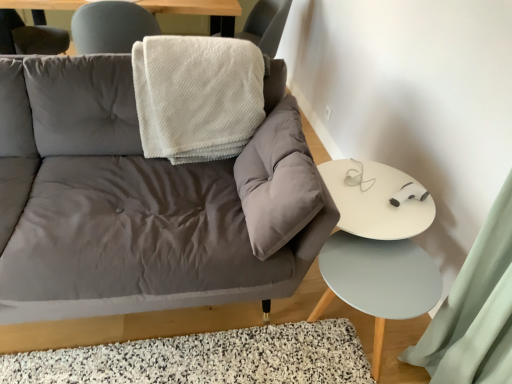
Locate an element on the screen. Image resolution: width=512 pixels, height=384 pixels. white fluffy blanket at upper center is located at coordinates (197, 96).

Measure the distance between point (200, 150) and camera.

Point (200, 150) is 5.63 feet away from camera.

The width and height of the screenshot is (512, 384). I want to click on light blue matte side table at lower right, so click(378, 281).

Measure the distance between point (42, 336) and camera.

Point (42, 336) is 5.10 feet away from camera.

Locate an element on the screen. This screenshot has height=384, width=512. white glossy table at right is located at coordinates (380, 243).

What do you see at coordinates (206, 358) in the screenshot? I see `white shaggy rug at lower center` at bounding box center [206, 358].

Where is `white fluffy blanket at upper center`? white fluffy blanket at upper center is located at coordinates (197, 96).

Which is closer to the camera, [378,265] or [384,312]?

Point [378,265].

Based on their positions, is light blue matte side table at lower right located to the left or right of white glossy table at right?

In the image, light blue matte side table at lower right appears on the left side of white glossy table at right.

From a real-world perspective, who is located lower, light blue matte side table at lower right or white shaggy rug at lower center?

white shaggy rug at lower center, from a real-world perspective.

Are light blue matte side table at lower right and white shaggy rug at lower center located far from each other?

light blue matte side table at lower right is actually quite close to white shaggy rug at lower center.

From the image's perspective, is light blue matte side table at lower right over white shaggy rug at lower center?

Yes, from the image's perspective, light blue matte side table at lower right is on top of white shaggy rug at lower center.

Considering the relative sizes of matte gray couch at center and white shaggy rug at lower center in the image provided, is matte gray couch at center taller than white shaggy rug at lower center?

Yes, matte gray couch at center is taller than white shaggy rug at lower center.

Is matte gray couch at center wider than white shaggy rug at lower center?

Yes, matte gray couch at center is wider than white shaggy rug at lower center.

Consider the image. Which is more to the right, matte gray couch at center or white shaggy rug at lower center?

From the viewer's perspective, white shaggy rug at lower center appears more on the right side.

Considering their positions, is matte gray couch at center located in front of or behind white shaggy rug at lower center?

matte gray couch at center is positioned closer to the viewer than white shaggy rug at lower center.

Where is `chair lying behind the white shaggy rug at lower center`? chair lying behind the white shaggy rug at lower center is located at coordinates (266, 25).

From a real-world perspective, is white shaggy rug at lower center beneath white textured blanket at upper center?

Yes, from a real-world perspective, white shaggy rug at lower center is under white textured blanket at upper center.

Considering their positions, is white shaggy rug at lower center located in front of or behind white textured blanket at upper center?

Answer: Clearly, white shaggy rug at lower center is in front of white textured blanket at upper center.

Based on their positions, is white shaggy rug at lower center located to the left or right of white textured blanket at upper center?

In the image, white shaggy rug at lower center appears on the left side of white textured blanket at upper center.

Are white glossy table at right and matte gray couch at center beside each other?

No, white glossy table at right is not beside matte gray couch at center.

Looking at this image, can you confirm if white glossy table at right is positioned to the right of matte gray couch at center?

Indeed, white glossy table at right is positioned on the right side of matte gray couch at center.

Based on their sizes in the image, would you say white glossy table at right is bigger or smaller than matte gray couch at center?

Clearly, white glossy table at right is smaller in size than matte gray couch at center.

Choose the correct answer: Is white glossy table at right inside matte gray couch at center or outside it?

The correct answer is: outside.

Is white fluffy blanket at upper center at the back of white textured blanket at upper center?

No.

Between white textured blanket at upper center and white fluffy blanket at upper center, which one has less height?

With less height is white fluffy blanket at upper center.

Would you say white textured blanket at upper center contains white fluffy blanket at upper center?

No, white fluffy blanket at upper center is not inside white textured blanket at upper center.

Does white textured blanket at upper center have a lesser width compared to white fluffy blanket at upper center?

Yes, white textured blanket at upper center is thinner than white fluffy blanket at upper center.

From the picture: Is matte gray couch at center positioned far away from white fluffy blanket at upper center?

No, there isn't a large distance between matte gray couch at center and white fluffy blanket at upper center.

How many degrees apart are the facing directions of matte gray couch at center and white fluffy blanket at upper center?

0.000147 degrees.

Who is more distant, matte gray couch at center or white fluffy blanket at upper center?

Positioned behind is white fluffy blanket at upper center.

Is matte gray couch at center thinner than white fluffy blanket at upper center?

No.

In order to click on side table that is under the white glossy table at right (from a real-world perspective) in this screenshot , I will do `click(378, 281)`.

This screenshot has width=512, height=384. Identify the location of mat on the left of the light blue matte side table at lower right. (206, 358).

Considering their positions, is white fluffy blanket at upper center positioned further to matte gray couch at center than white glossy table at right?

white fluffy blanket at upper center is further to matte gray couch at center.

Based on their spatial positions, is white glossy table at right or white textured blanket at upper center closer to matte gray couch at center?

The object closer to matte gray couch at center is white glossy table at right.

Based on their spatial positions, is light blue matte side table at lower right or white glossy table at right closer to matte gray couch at center?

light blue matte side table at lower right is closer to matte gray couch at center.

Looking at the image, which one is located closer to matte gray couch at center, white fluffy blanket at upper center or white textured blanket at upper center?

The object closer to matte gray couch at center is white fluffy blanket at upper center.

From the image, which object appears to be nearer to light blue matte side table at lower right, white shaggy rug at lower center or white glossy table at right?

The object closer to light blue matte side table at lower right is white glossy table at right.

Based on their spatial positions, is white textured blanket at upper center or light blue matte side table at lower right closer to white shaggy rug at lower center?

light blue matte side table at lower right.

From the image, which object appears to be nearer to white textured blanket at upper center, white fluffy blanket at upper center or matte gray couch at center?

white fluffy blanket at upper center.

Based on their spatial positions, is light blue matte side table at lower right or white fluffy blanket at upper center closer to matte gray couch at center?

light blue matte side table at lower right lies closer to matte gray couch at center than the other object.

You are a GUI agent. You are given a task and a screenshot of the screen. Output one action in this format:
    pyautogui.click(x=<x>, y=<y>)
    Task: Click on the side table between white shaggy rug at lower center and white glossy table at right
    This screenshot has height=384, width=512.
    Given the screenshot: What is the action you would take?
    pyautogui.click(x=378, y=281)

What are the coordinates of `mat between matte gray couch at center and light blue matte side table at lower right from left to right` in the screenshot? It's located at (206, 358).

At what (x,y) coordinates should I click in order to perform the action: click on round table between white textured blanket at upper center and white shaggy rug at lower center in the up-down direction. Please return your answer as a coordinate pair (x, y). Looking at the image, I should click on (380, 243).

The height and width of the screenshot is (384, 512). What are the coordinates of `round table between white textured blanket at upper center and light blue matte side table at lower right in the vertical direction` in the screenshot? It's located at (380, 243).